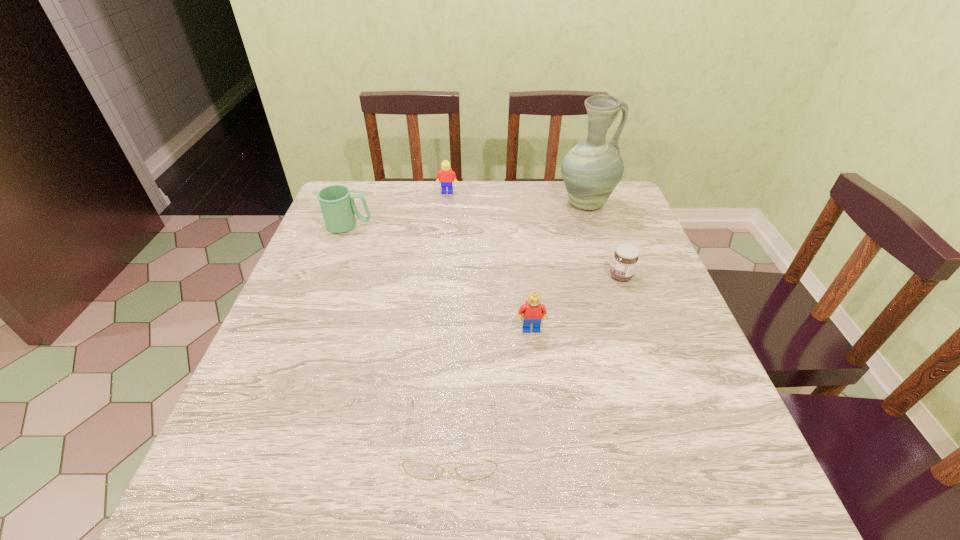
Find the location of `pitcher`. pitcher is located at coordinates tap(591, 170).

Identify the location of the left Lego. This screenshot has height=540, width=960. (446, 175).

Locate an element on the screen. This screenshot has width=960, height=540. mug is located at coordinates (338, 208).

You are a GUI agent. You are given a task and a screenshot of the screen. Output one action in this format:
    pyautogui.click(x=<x>, y=<y>)
    Task: Click on the fourth object from left to right
    The width and height of the screenshot is (960, 540).
    Given the screenshot: What is the action you would take?
    pyautogui.click(x=533, y=311)

Where is `the fifth farthest object`? The image size is (960, 540). the fifth farthest object is located at coordinates (533, 311).

Locate an element on the screen. This screenshot has height=540, width=960. the second shortest object is located at coordinates (626, 256).

This screenshot has height=540, width=960. Find the location of `the fourth farthest object`. the fourth farthest object is located at coordinates (626, 256).

Identify the location of the nearest object. (480, 470).

Identify the location of the shortest object. The image size is (960, 540). (480, 470).

Image resolution: width=960 pixels, height=540 pixels. Find the location of `vacant area situated 0.150m on the front-facing side of the left Lego`. vacant area situated 0.150m on the front-facing side of the left Lego is located at coordinates coord(444,222).